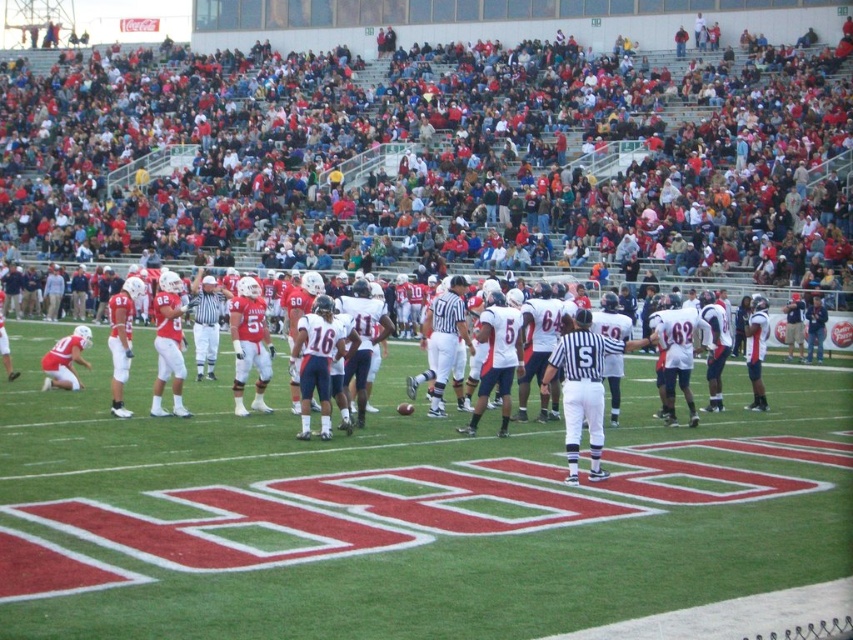
In the scene shown: You are a photographer at the stadium and want to capture a photo of the white striped referee at center and the white uniformed players at center. Based on their sizes, which one would appear smaller in the photo?

The white striped referee at center would appear smaller in the photo because their width is less than the white uniformed players at center.

You are a photographer at the stadium and want to capture a photo that includes both the red fabric crowd at upper center and the white uniform at center. Which object should you zoom in on to ensure both are visible in the frame?

The red fabric crowd at upper center is wider than the white uniform at center. To include both in the frame, you should zoom in on the wider object, which is the red fabric crowd at upper center.